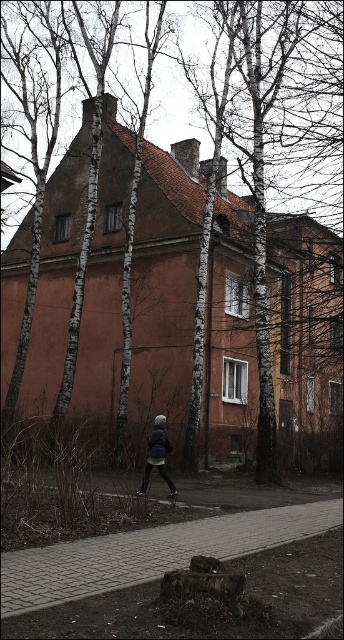
You are a delivery person carrying a large box that is 1.2 meters wide. You need to walk along the paved brick sidewalk at center while avoiding stepping on the dark blue fabric jacket at center. Is the sidewalk wide enough for you to pass safely with the box?

The paved brick sidewalk at center might be wider than dark blue fabric jacket at center, so there is a possibility that the sidewalk is wide enough for the delivery person to pass safely with the 1.2 meters wide box. However, since the exact width isn not provided, it is recommended to check the actual dimensions before proceeding.

You are planning to install a new garden feature between the white bark tree at center and the paved brick sidewalk at center. Considering their sizes, which object should you place closer to the smaller one to maintain balance?

Since the white bark tree at center is larger than the paved brick sidewalk at center, you should place the garden feature closer to the paved brick sidewalk at center to balance the composition.

You are standing on the paved brick sidewalk at center in front of the two story building. You want to walk towards the entrance of the building but notice a white bark tree at center. Which direction should you move to avoid the tree and continue on the sidewalk?

The white bark tree at center is positioned over the paved brick sidewalk at center, so you should move to the side of the sidewalk away from the tree to continue walking towards the entrance without obstruction.